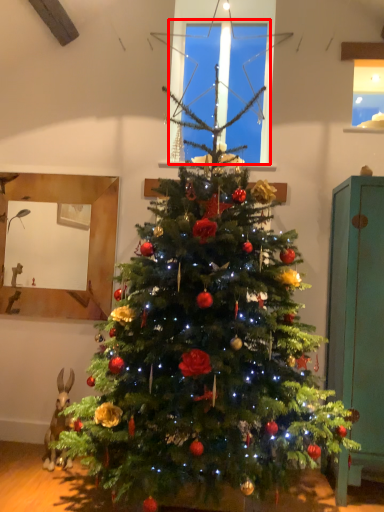
Question: From the image's perspective, where is window screen (annotated by the red box) located in relation to armoire in the image?

Choices:
 (A) below
 (B) above

Answer: (B)